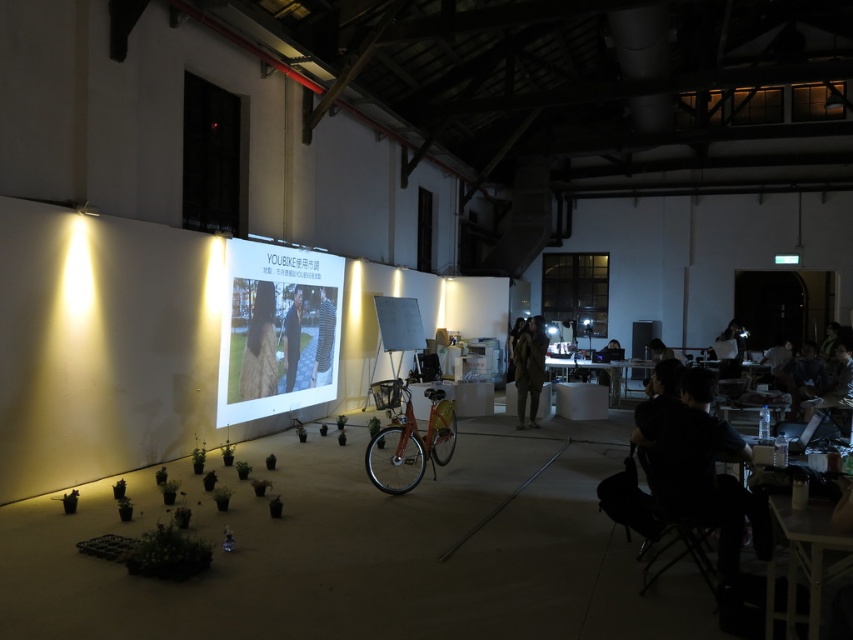
Question: Which point is closer to the camera?

Choices:
 (A) (326, 362)
 (B) (322, 365)

Answer: (B)

Question: Based on their relative distances, which object is farther from the dark blue shirt at center?

Choices:
 (A) matte white projection screen at center
 (B) long brown hair at center
 (C) matte black laptop at lower right
 (D) black fabric chair at lower right

Answer: (C)

Question: Is matte white projection screen at center bigger than matte black laptop at lower right?

Choices:
 (A) yes
 (B) no

Answer: (A)

Question: Does matte white projection screen at center appear on the right side of striped shirt at center?

Choices:
 (A) no
 (B) yes

Answer: (A)

Question: Based on their relative distances, which object is farther from the striped shirt at center?

Choices:
 (A) dark blue shirt at center
 (B) matte black laptop at lower right
 (C) long brown hair at center

Answer: (B)

Question: Can you confirm if matte white projection screen at center is positioned above matte black laptop at lower right?

Choices:
 (A) no
 (B) yes

Answer: (B)